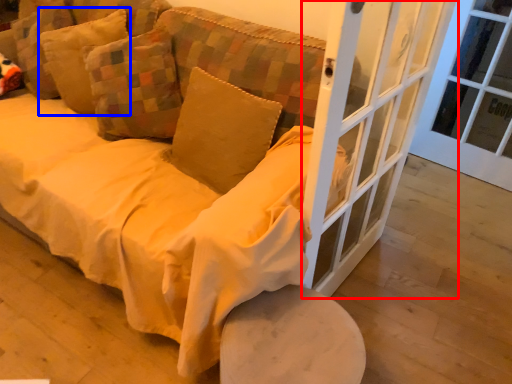
Question: Which object appears closest to the camera in this image, screen door (highlighted by a red box) or pillow (highlighted by a blue box)?

Choices:
 (A) screen door
 (B) pillow

Answer: (A)